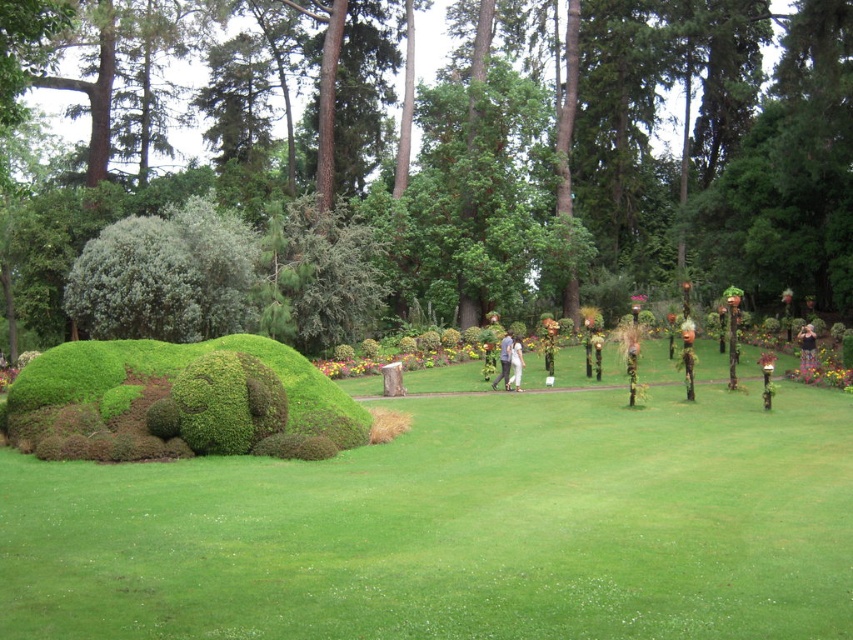
Which is more to the right, floral dress at center or white cotton pants at center?

Positioned to the right is floral dress at center.

Who is more forward, (808, 324) or (521, 371)?

Point (521, 371) is in front.

What are the coordinates of `floral dress at center` in the screenshot? It's located at (807, 346).

Can you confirm if green grass at center is positioned above white cotton pants at center?

No, green grass at center is not above white cotton pants at center.

Who is more forward, [842,397] or [512,368]?

Point [842,397] is more forward.

What do you see at coordinates (459, 528) in the screenshot? The width and height of the screenshot is (853, 640). I see `green grass at center` at bounding box center [459, 528].

This screenshot has width=853, height=640. In order to click on green grass at center in this screenshot , I will do click(459, 528).

Does green grass at center appear on the left side of floral dress at center?

Correct, you'll find green grass at center to the left of floral dress at center.

Can you confirm if green grass at center is positioned below floral dress at center?

Indeed, green grass at center is positioned under floral dress at center.

Which is behind, point (439, 452) or point (810, 326)?

Point (810, 326)

You are a GUI agent. You are given a task and a screenshot of the screen. Output one action in this format:
    pyautogui.click(x=<x>, y=<y>)
    Task: Click on the green grass at center
    
    Given the screenshot: What is the action you would take?
    pyautogui.click(x=459, y=528)